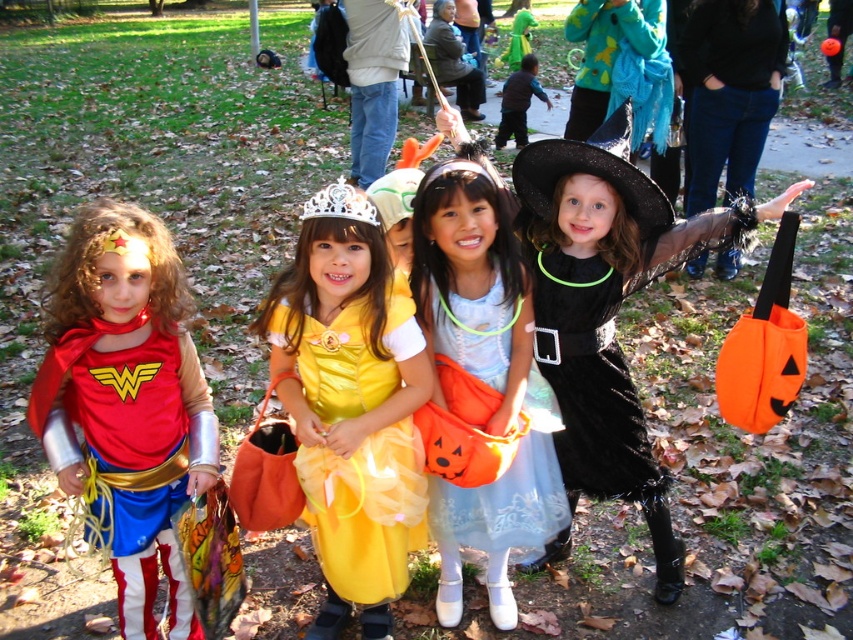
You are a photographer trying to capture a clear shot of the matte red cape at left and the light blue satin dress at center. Based on their positions, which object is closer to the camera?

The matte red cape at left is positioned under the light blue satin dress at center, meaning it is closer to the camera.

Based on the photo, you are a photographer trying to capture the Wonder Woman costume at left. The matte red cape at left is at point (126, 403). Where should you position your camera to ensure the cape is in the frame?

To ensure the matte red cape at left is in the frame, position the camera near the point (126, 403) where the cape is located.

You are a photographer trying to capture a clear shot of the light blue satin dress at center and the black matte witch hat at center. Which object should you focus on first if you want to ensure both are in focus?

The light blue satin dress at center is below the black matte witch hat at center, so you should focus on the black matte witch hat at center first to ensure both are in focus.